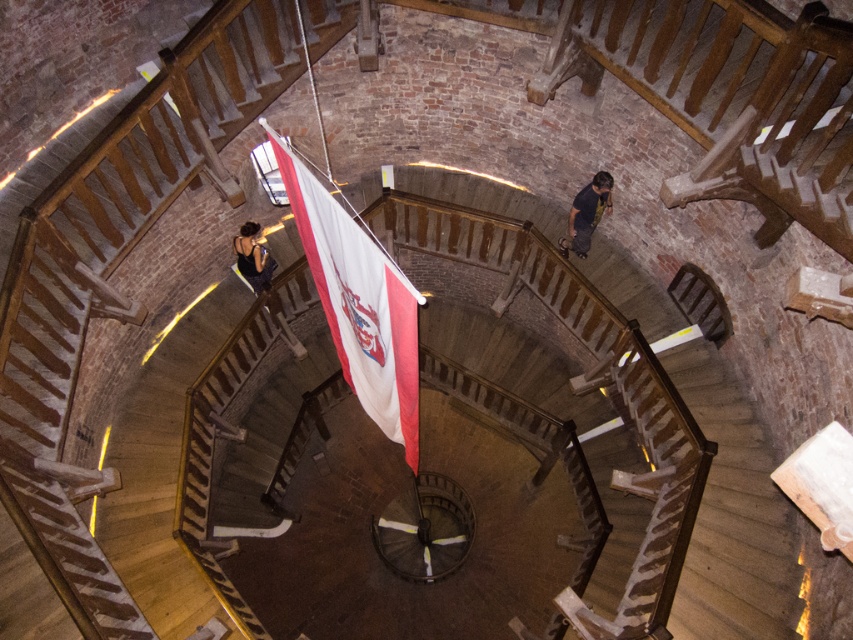
Looking at this image, you are standing at the base of the spiral staircase and want to reach the dark blue shirt at center. The flagpole with the white fabric flag at center is in your way. Can you walk around the flagpole to reach the shirt without touching the flag?

The white fabric flag at center is 3.66 meters away from the dark blue shirt at center. Since the flagpole is in the center, you can walk around it to reach the shirt as long as there is enough space between the flagpole and the staircase walls. However, the exact distance between them isn

You are standing at the base of the spiral staircase and want to hang a new decorative banner. The existing flag at the center is at point (358, 304). Where should you place your banner to ensure it is directly above the existing flag?

You should place your banner at the same coordinates as the existing flag, which is at point (358, 304), to ensure it is directly above the existing flag.